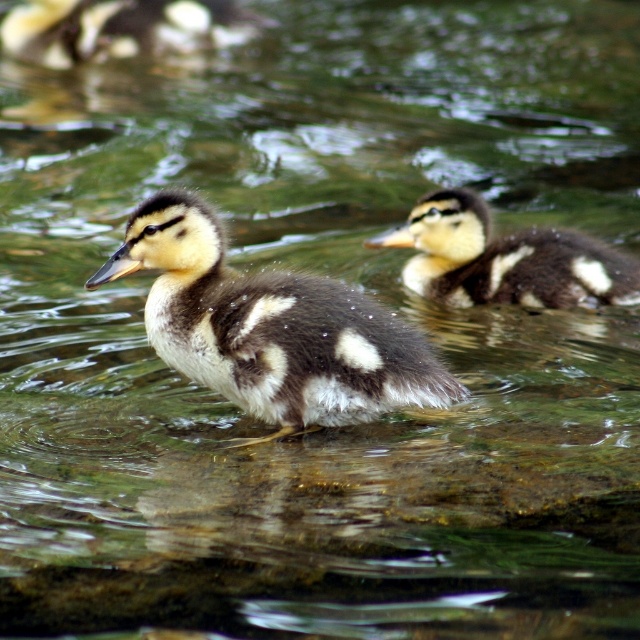
There are two ducklings in the water. The first is a brown speckled duckling at center. The second is partially visible in the background. How far apart are these two ducklings?

The two ducklings are 1.94 meters apart.

You are a birdwatcher observing two ducklings in the water. You notice the brown speckled duckling at center and the soft brown duckling at center. Which duckling is closer to you?

The brown speckled duckling at center is closer to you because it is positioned under the soft brown duckling at center, indicating it is in front.

You are a wildlife photographer aiming to capture a closeup shot of both the soft brown duckling at center and the soft brown duckling at upper left. Given that your camera has a maximum focus range of 7 feet, will you be able to capture both ducklings in a single shot?

The distance between the soft brown duckling at center and the soft brown duckling at upper left is 7.62 feet, which exceeds the camera maximum focus range of 7 feet. Therefore, you cannot capture both ducklings in a single shot.